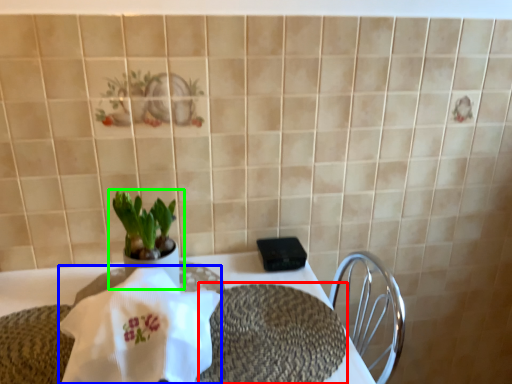
Question: Which object is positioned farthest from place mat (highlighted by a red box)? Select from cloth (highlighted by a blue box) and houseplant (highlighted by a green box).

Choices:
 (A) cloth
 (B) houseplant

Answer: (B)